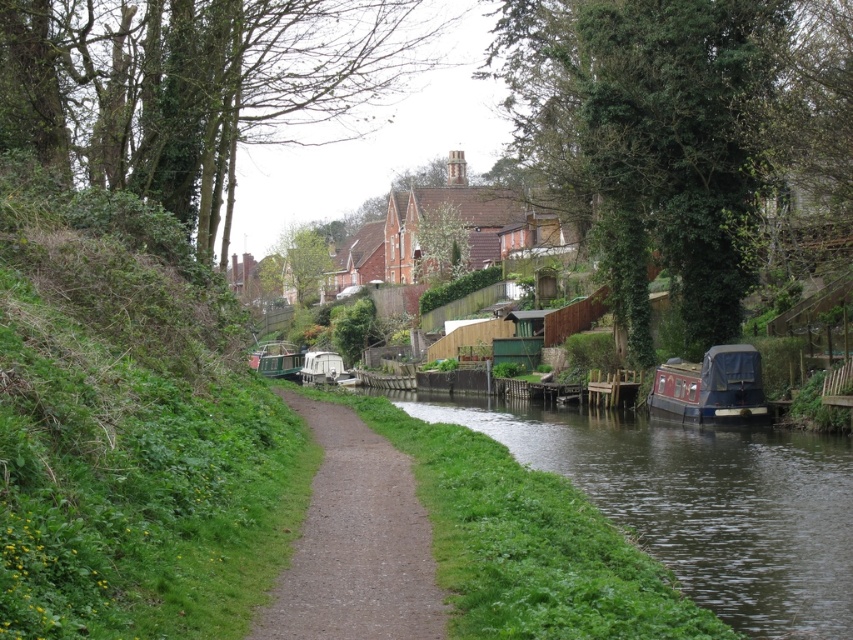
Is point (822, 568) farther from viewer compared to point (270, 344)?

That is False.

Can you confirm if dark blue wood at lower right is positioned to the left of green matte boat at center?

No, dark blue wood at lower right is not to the left of green matte boat at center.

Identify the location of dark blue wood at lower right. (699, 502).

Consider the image. Between dark blue wood at lower right and white plastic boat at center, which one appears on the right side from the viewer's perspective?

dark blue wood at lower right

Is point (804, 483) less distant than point (323, 376)?

Yes, it is.

Is point (648, 452) positioned in front of point (300, 378)?

Yes, it is.

The height and width of the screenshot is (640, 853). Find the location of `dark blue wood at lower right`. dark blue wood at lower right is located at coordinates (699, 502).

Is green leafy tree at upper left taller than red painted wooden boat at right?

Indeed, green leafy tree at upper left has a greater height compared to red painted wooden boat at right.

Is point (109, 92) more distant than point (706, 420)?

No, it is not.

Describe the element at coordinates (200, 88) in the screenshot. I see `green leafy tree at upper left` at that location.

Image resolution: width=853 pixels, height=640 pixels. Find the location of `green leafy tree at upper left`. green leafy tree at upper left is located at coordinates (200, 88).